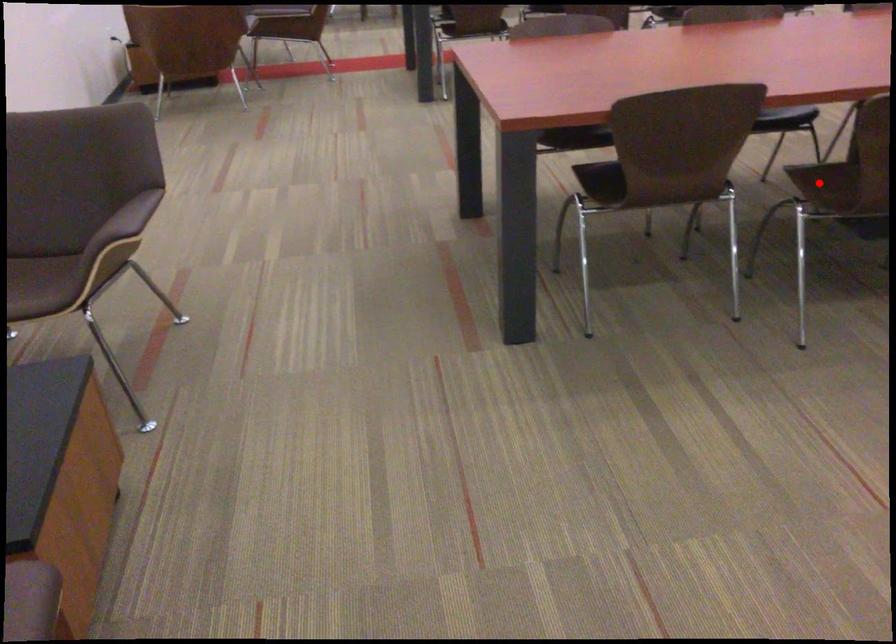
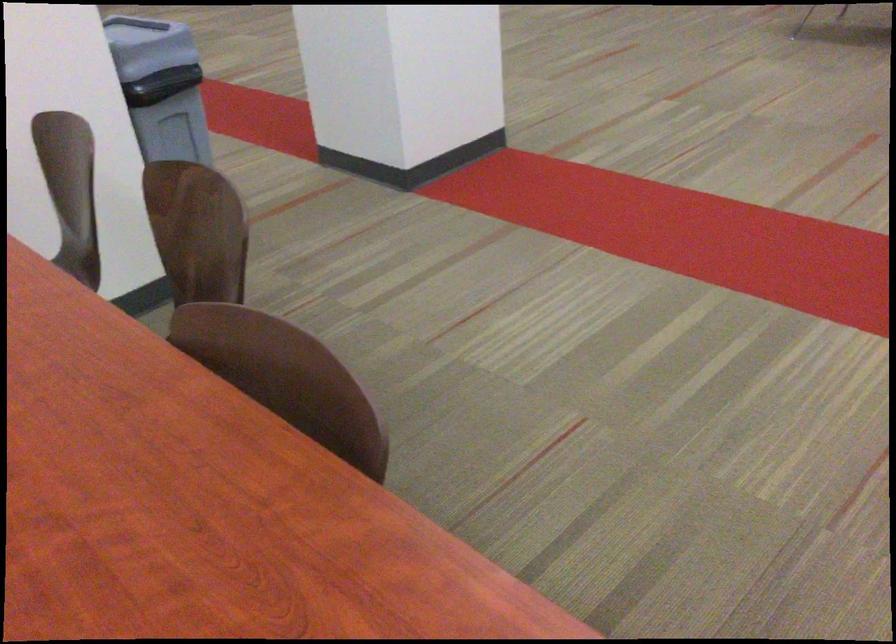
Question: I am providing you with two images of the same scene from different viewpoints. A red point is marked on the first image. Can you still see the location of the red point in image 2?

Choices:
 (A) Yes
 (B) No

Answer: (B)